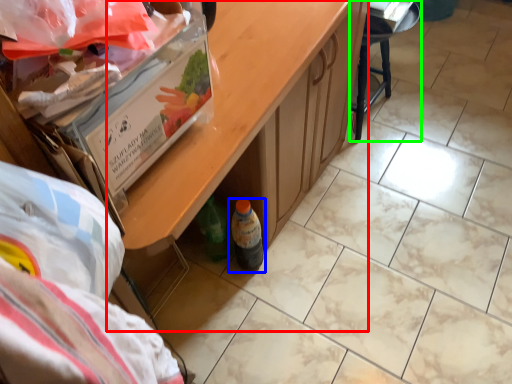
Question: Which object is positioned farthest from table (highlighted by a red box)? Select from bottle (highlighted by a blue box) and furniture (highlighted by a green box).

Choices:
 (A) bottle
 (B) furniture

Answer: (B)